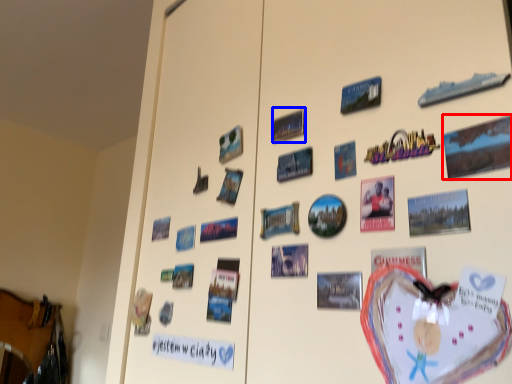
Question: Among these objects, which one is nearest to the camera, postcard (highlighted by a red box) or poster (highlighted by a blue box)?

Choices:
 (A) postcard
 (B) poster

Answer: (A)